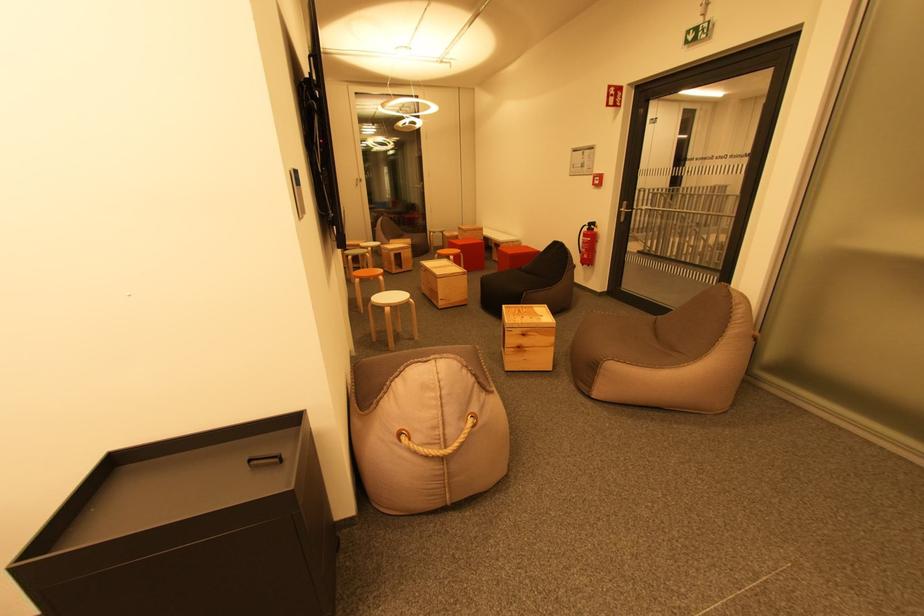
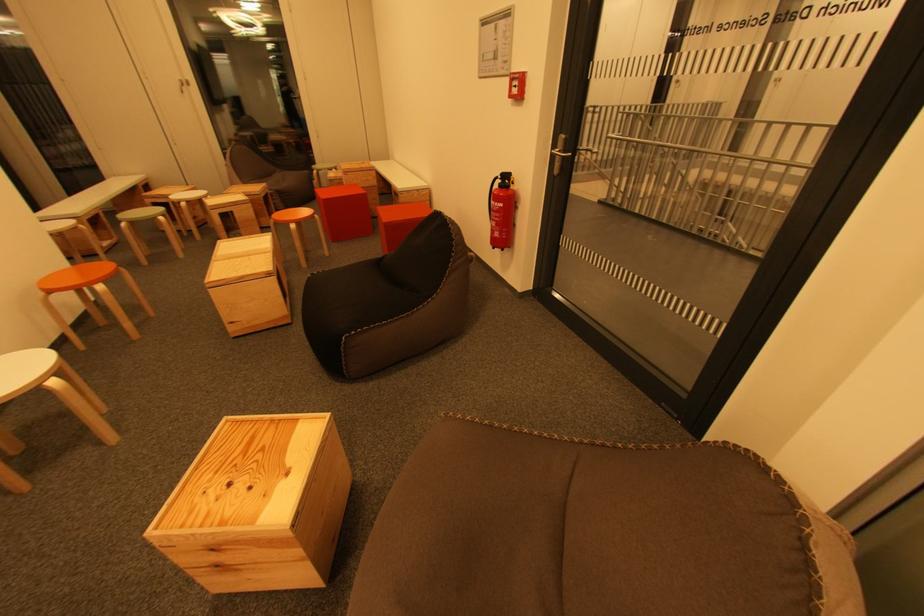
In a continuous first-person perspective shot, in which direction is the camera moving?

The movement direction of the cameraman is right, forward.